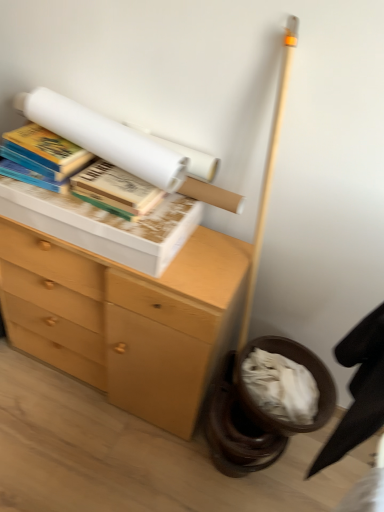
Find the location of a particular element. The image size is (384, 512). vacant point above hardcover book at upper left, which is counted as the third book, starting from the right (from a real-world perspective) is located at coordinates (46, 138).